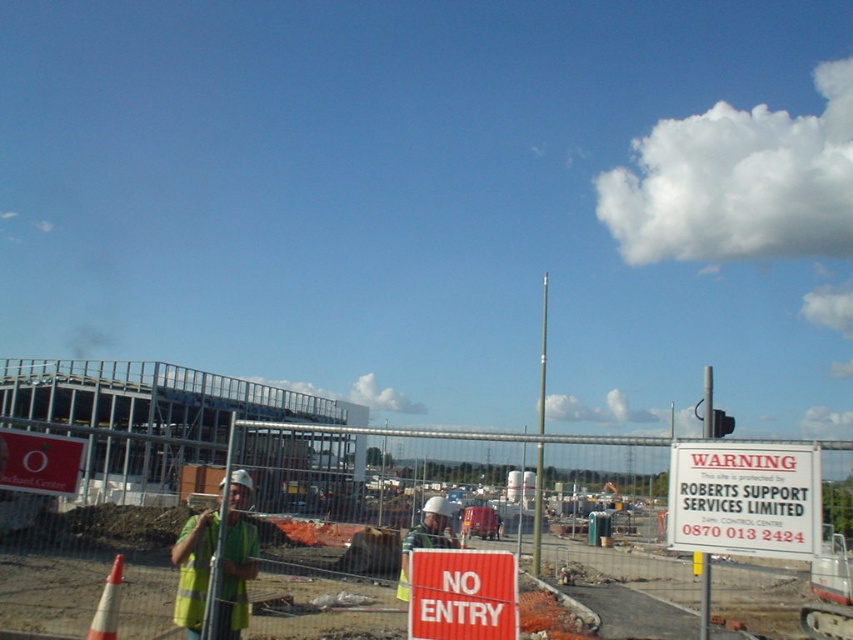
Consider the image. You are a delivery driver who needs to drop off a package at the construction site. The package must be placed exactly between the metal fence at center and the red corrugated metal sign at center. How far apart are these two objects so you can position the package correctly?

The metal fence at center and red corrugated metal sign at center are 24.72 meters apart from each other. To place the package exactly between them, you should position it 12.36 meters from each object.

You are a drone operator tasked with capturing aerial footage of the construction site. You need to ensure that your drone stays above the metal fence at center to avoid restricted areas. Given that the drone is currently at point coordinates of (286,508), is the drone positioned safely above the restricted area?

The point coordinates (286,508) correspond to the metal fence at center, so the drone is positioned directly above the metal fence at center. Since the fence marks the restricted area boundary, the drone is not safely positioned above the restricted area and should move further away from the fence.

You are a safety inspector checking the visibility of safety equipment in the construction site. You notice the yellow reflective vest at center and the white plastic sign at upper left. Which object is taller?

The yellow reflective vest at center is much taller than the white plastic sign at upper left.